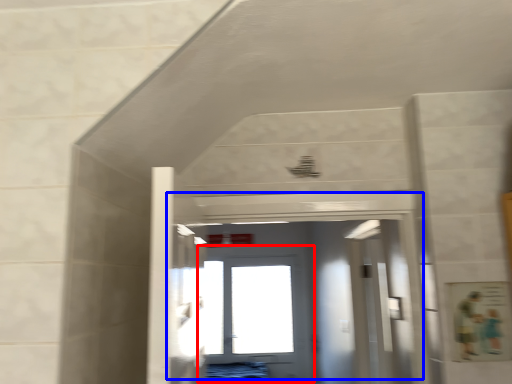
Question: Which point is further to the camera, door (highlighted by a red box) or door (highlighted by a blue box)?

Choices:
 (A) door
 (B) door

Answer: (A)